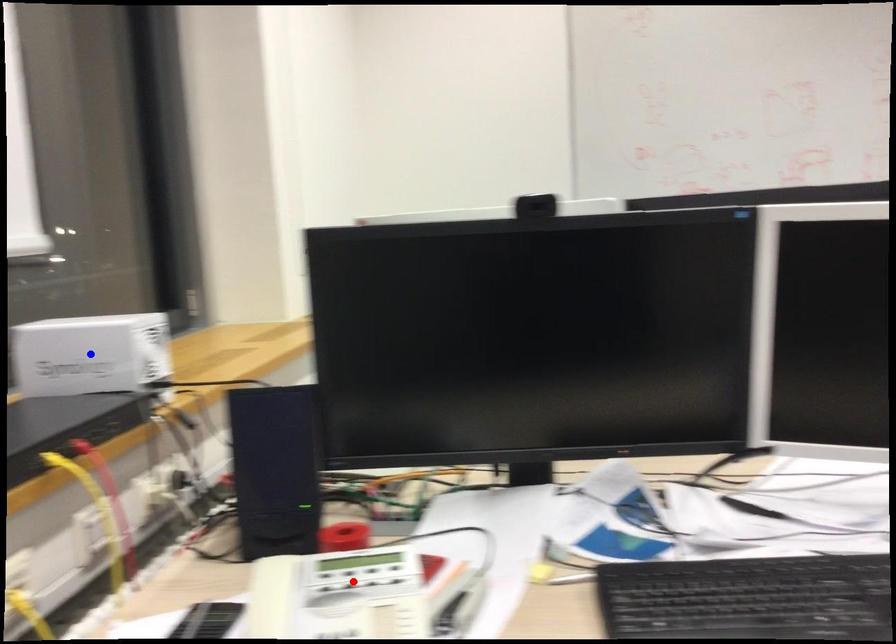
Question: Which of the two points in the image is closer to the camera?

Choices:
 (A) Blue point is closer.
 (B) Red point is closer.

Answer: (B)